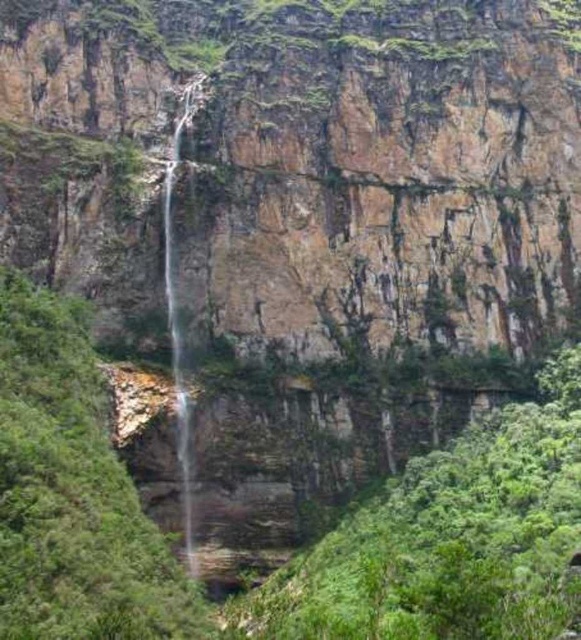
You are standing at the base of the waterfall and want to take a photo of the point at coordinates point (101, 136). Your camera has a maximum focus range of 100 meters. Will you be able to focus on the point?

The distance of point (101, 136) from viewer is 105.29 meters, which exceeds the camera maximum focus range of 100 meters. Therefore, the camera cannot focus on the point.

You are a hiker standing at the base of the waterfall. You want to cross from the left side to the right side of the waterfall. The brown rocky cliff at center and clear water at center are in your path. Which path would you take to cross safely?

You should take the path along the brown rocky cliff at center because its width surpasses that of the clear water at center, making it more stable and safer for crossing.